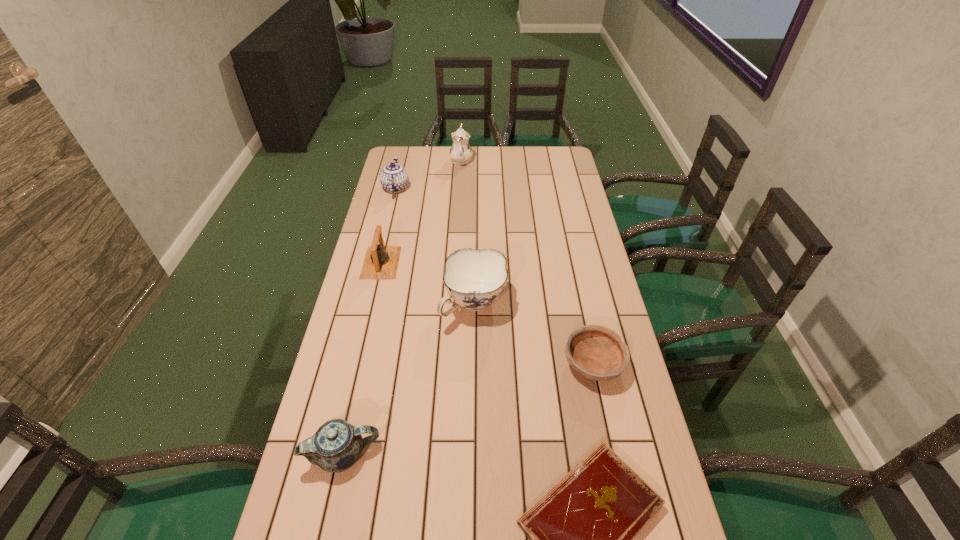
Locate an element on the screen. free space located 0.190m at the spout of the second farthest object is located at coordinates [404, 153].

Where is `free spot located 0.180m at the spout of the second farthest object`? The height and width of the screenshot is (540, 960). free spot located 0.180m at the spout of the second farthest object is located at coordinates (404, 154).

This screenshot has height=540, width=960. What are the coordinates of `vacant region located 0.160m on the right of the bell` in the screenshot? It's located at (444, 263).

Find the location of `vacant region located 0.170m from the spout of the nearest chinaware`. vacant region located 0.170m from the spout of the nearest chinaware is located at coordinates (448, 454).

You are a GUI agent. You are given a task and a screenshot of the screen. Output one action in this format:
    pyautogui.click(x=<x>, y=<y>)
    Task: Click on the vacant region located on the left of the third nearest object
    This screenshot has height=540, width=960.
    Given the screenshot: What is the action you would take?
    pyautogui.click(x=511, y=364)

You are a GUI agent. You are given a task and a screenshot of the screen. Output one action in this format:
    pyautogui.click(x=<x>, y=<y>)
    Task: Click on the object located at the far edge
    This screenshot has width=960, height=540.
    Given the screenshot: What is the action you would take?
    pyautogui.click(x=460, y=152)

Where is `bell that is at the left edge`? This screenshot has height=540, width=960. bell that is at the left edge is located at coordinates (381, 262).

Locate an element on the screen. Image resolution: width=960 pixels, height=540 pixels. object that is at the right edge is located at coordinates (x=595, y=352).

This screenshot has width=960, height=540. I want to click on vacant space at the far edge of the desktop, so click(x=449, y=148).

At what (x,y) coordinates should I click in order to perform the action: click on vacant space at the left edge. Please return your answer as a coordinate pair (x, y). Looking at the image, I should click on (414, 180).